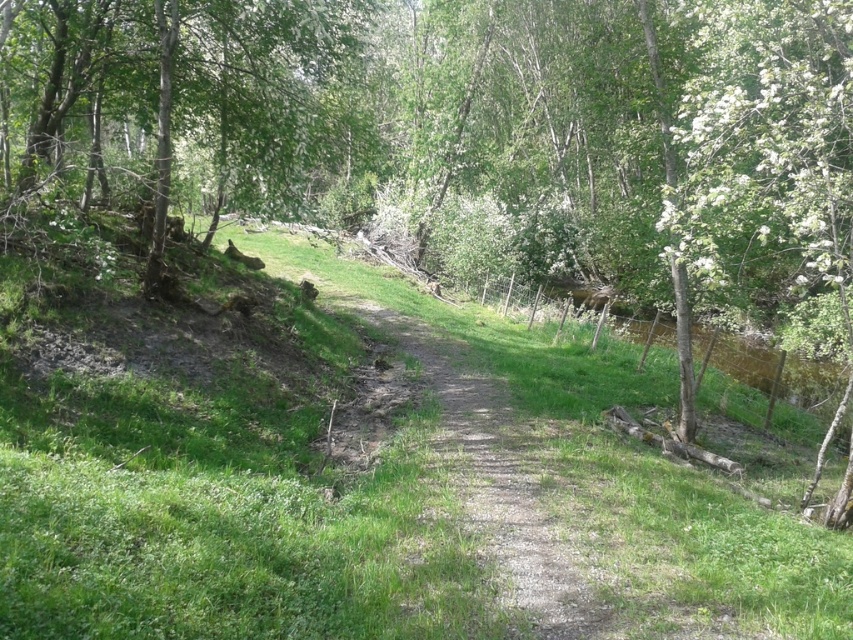
Can you confirm if green grassy at center is smaller than dirt/gravel path at center?

Actually, green grassy at center might be larger than dirt/gravel path at center.

Does point (430, 456) come in front of point (540, 512)?

No, (430, 456) is behind (540, 512).

Between point (80, 330) and point (445, 406), which one is positioned in front?

Point (80, 330) is in front.

Where is `green grassy at center`? Image resolution: width=853 pixels, height=640 pixels. green grassy at center is located at coordinates (346, 474).

Consider the image. Is green leafy tree at upper left bigger than dirt/gravel path at center?

Yes.

From the picture: Who is more forward, (109, 22) or (558, 566)?

Positioned in front is point (558, 566).

Is point (288, 122) positioned after point (457, 451)?

Yes, point (288, 122) is behind point (457, 451).

The image size is (853, 640). I want to click on green leafy tree at upper left, so click(x=193, y=92).

Does green grassy at center have a lesser height compared to green leafy tree at upper left?

Correct, green grassy at center is not as tall as green leafy tree at upper left.

Between green grassy at center and green leafy tree at upper left, which one has less height?

green grassy at center

This screenshot has width=853, height=640. What are the coordinates of `green grassy at center` in the screenshot? It's located at (346, 474).

Where is `green grassy at center`? This screenshot has height=640, width=853. green grassy at center is located at coordinates (346, 474).